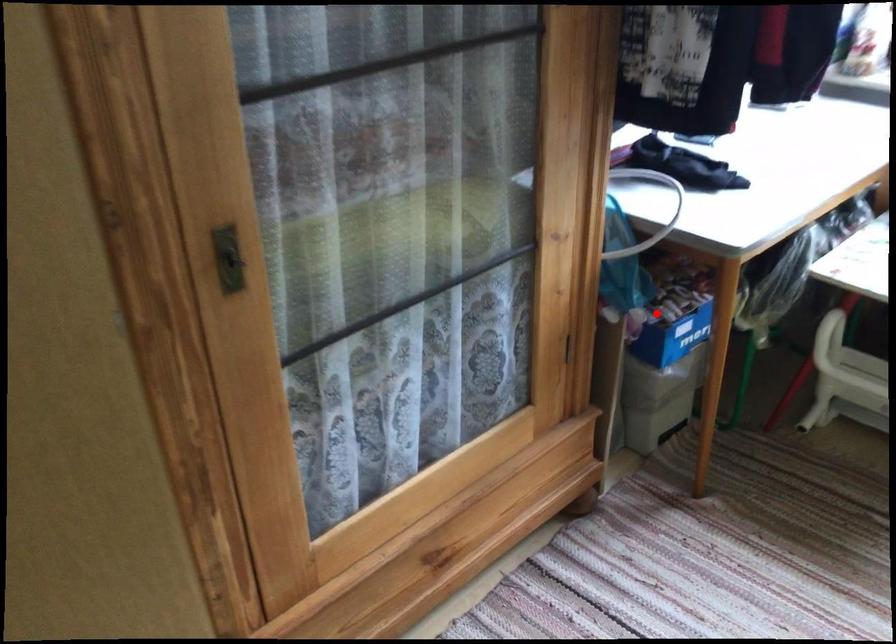
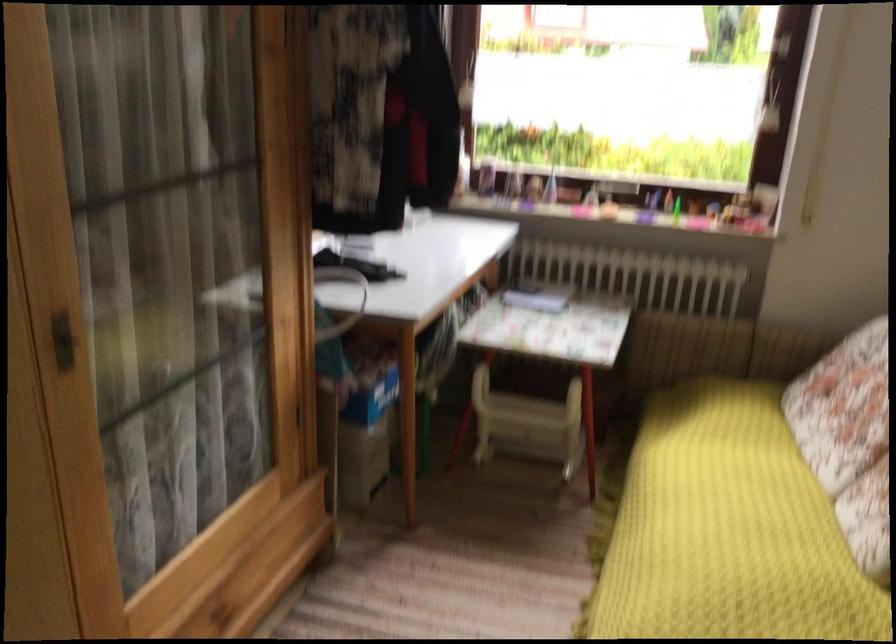
Where in the second image is the point corresponding to the highlighted location from the first image?

(360, 381)